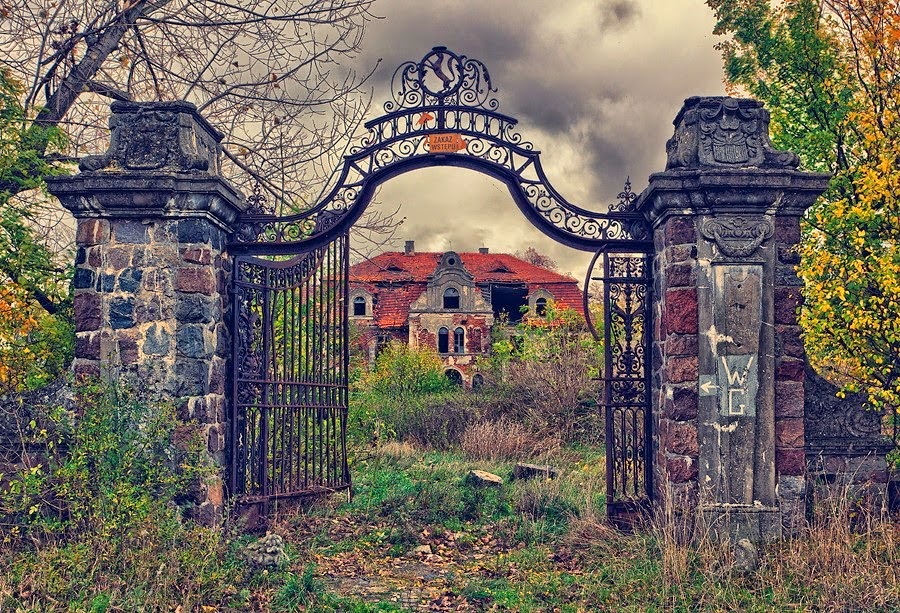
You are a GUI agent. You are given a task and a screenshot of the screen. Output one action in this format:
    pyautogui.click(x=<x>, y=<y>)
    Task: Click on the windows
    The image size is (900, 613).
    Given the screenshot: What is the action you would take?
    pyautogui.click(x=452, y=295), pyautogui.click(x=549, y=311), pyautogui.click(x=461, y=338), pyautogui.click(x=441, y=338), pyautogui.click(x=358, y=303)